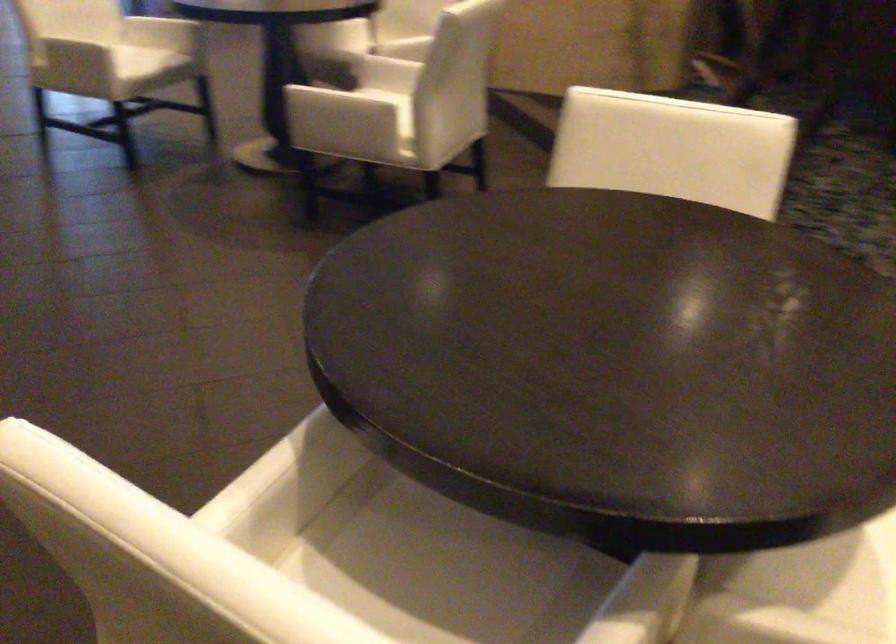
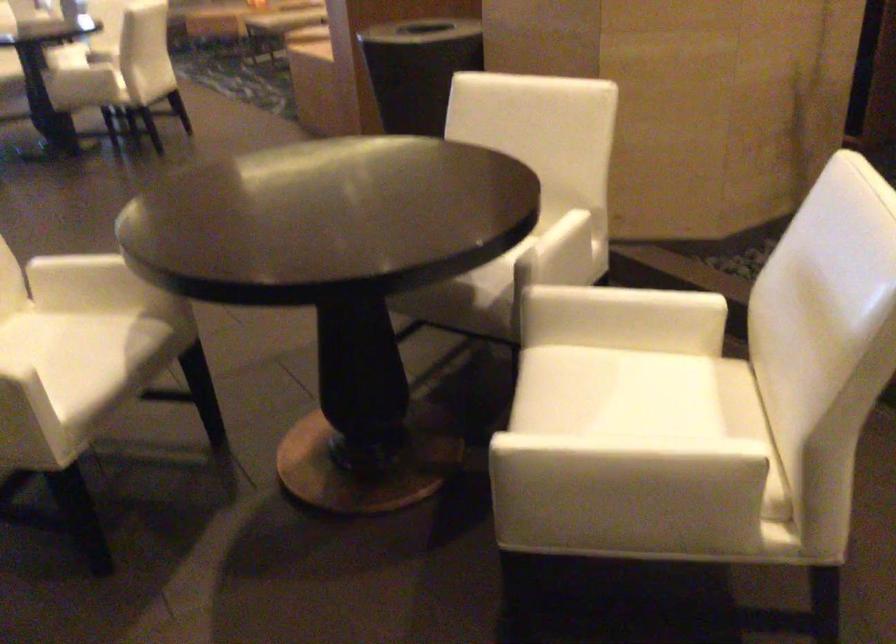
Locate, in the second image, the point that corresponds to point 366,76 in the first image.

(640, 393)